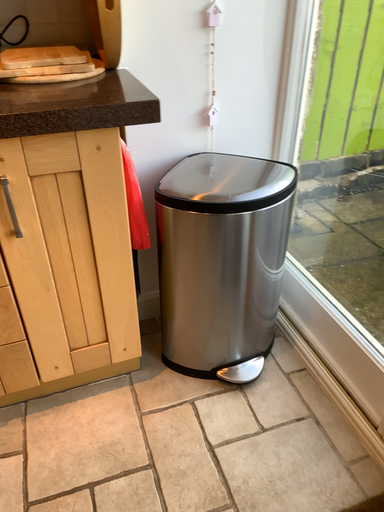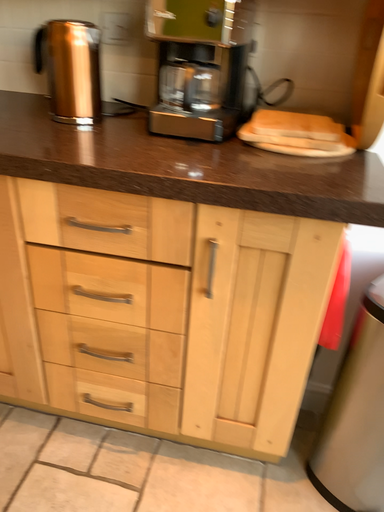
Question: How did the camera likely rotate when shooting the video?

Choices:
 (A) rotated left
 (B) rotated right

Answer: (A)